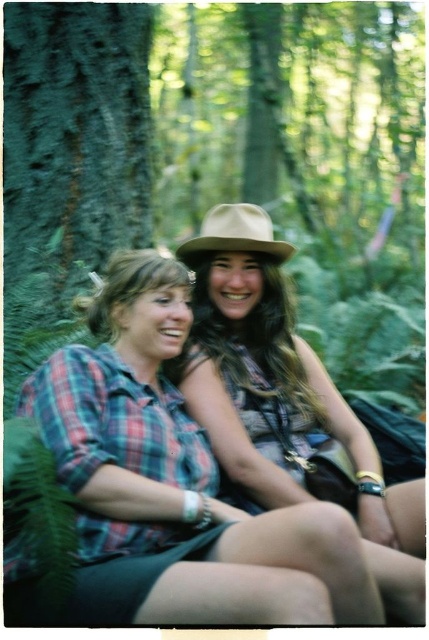
Question: Is plaid fabric shirt at center below green rough bark at left?

Choices:
 (A) yes
 (B) no

Answer: (A)

Question: Among these objects, which one is farthest from the camera?

Choices:
 (A) green rough bark at left
 (B) matte brown hat at center
 (C) brown felt fedora at center
 (D) plaid fabric shirt at center

Answer: (C)

Question: Does green rough bark at left lie in front of brown felt fedora at center?

Choices:
 (A) no
 (B) yes

Answer: (B)

Question: Among these points, which one is nearest to the camera?

Choices:
 (A) (91, 568)
 (B) (24, 88)
 (C) (181, 259)
 (D) (401, 532)

Answer: (A)

Question: Can you confirm if plaid fabric shirt at center is smaller than green rough bark at left?

Choices:
 (A) yes
 (B) no

Answer: (A)

Question: Which point is closer to the camera?

Choices:
 (A) plaid fabric shirt at center
 (B) matte brown hat at center
 (C) green rough bark at left

Answer: (A)